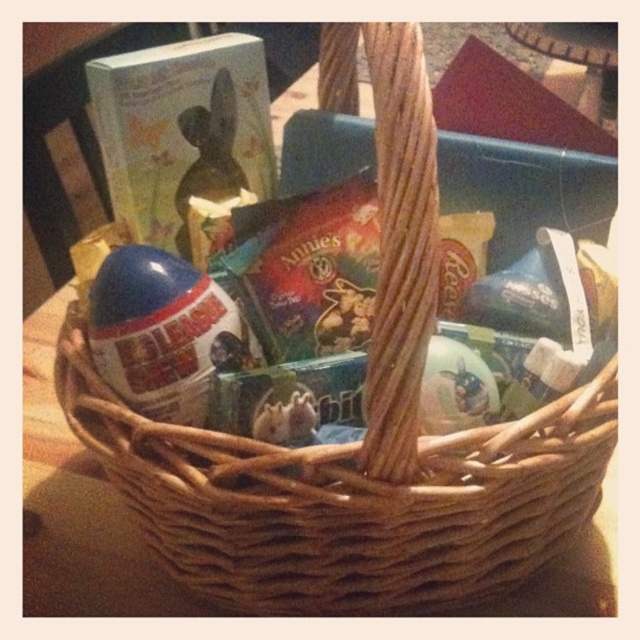
Question: Can you confirm if blue plastic egg at center is positioned to the right of shiny plastic bunny at center?

Choices:
 (A) yes
 (B) no

Answer: (B)

Question: Which point is farther to the camera?

Choices:
 (A) shiny plastic bunny at center
 (B) blue plastic egg at center

Answer: (A)

Question: Which point is closer to the camera taking this photo?

Choices:
 (A) (220, 124)
 (B) (156, 365)

Answer: (B)

Question: Is blue plastic egg at center further to camera compared to shiny plastic bunny at center?

Choices:
 (A) yes
 (B) no

Answer: (B)

Question: Is blue plastic egg at center wider than shiny plastic bunny at center?

Choices:
 (A) no
 (B) yes

Answer: (B)